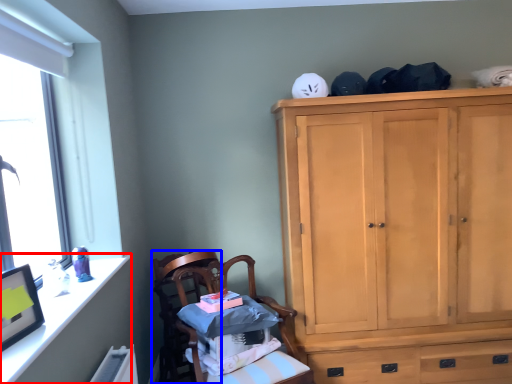
Question: Which object is further to the camera taking this photo, vanity (highlighted by a red box) or chair (highlighted by a blue box)?

Choices:
 (A) vanity
 (B) chair

Answer: (B)